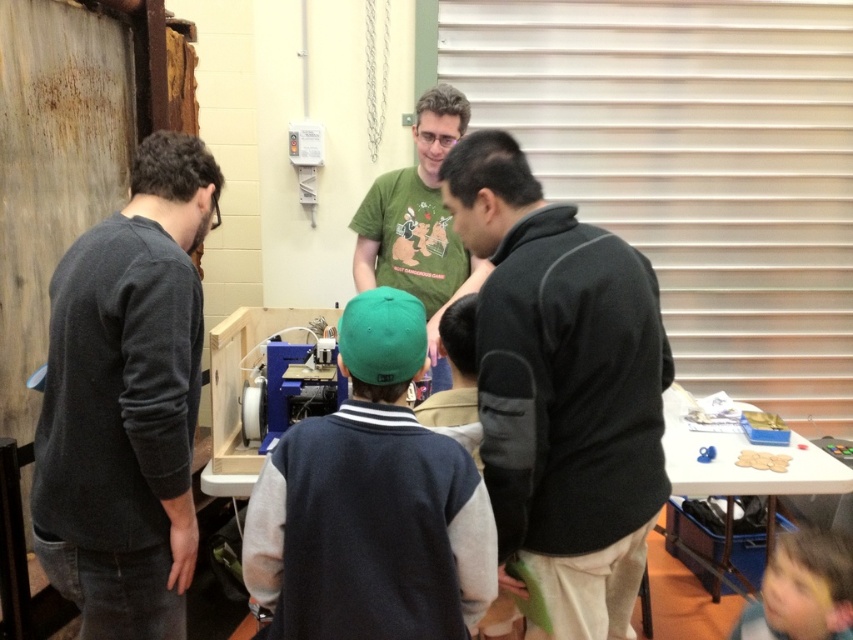
You are a photographer trying to capture a clear shot of the green fabric cap at center and the smooth brown hair at lower right. Since you want both subjects to be in focus, you need to adjust your camera settings based on their heights. Which object should you focus on first to ensure proper depth of field?

The green fabric cap at center is taller than the smooth brown hair at lower right, so you should focus on the green fabric cap at center first to ensure both are in focus.

In the scene described, there are two items of clothing visible. The dark gray sweater at left and the green fabric cap at center. From the perspective of someone standing in the middle of the group, which clothing item is positioned to the left?

The dark gray sweater at left is positioned to the left of the green fabric cap at center.

You are a photographer setting up a tripod to capture the scene. The tripod has a height adjustment feature. To ensure both the dark gray fleece jacket at center and the green fabric cap at center are fully visible in the frame, what should you do with the tripod height?

Since the dark gray fleece jacket at center is taller than the green fabric cap at center, you should adjust the tripod to a lower height to ensure both are fully visible in the frame.